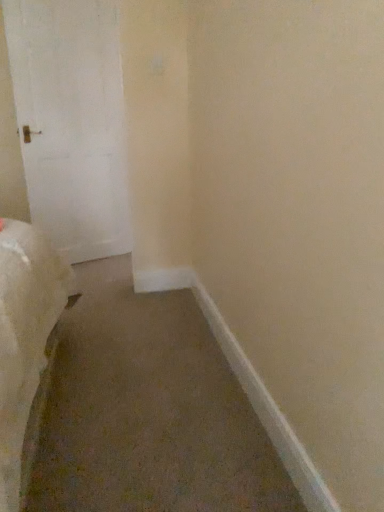
Question: Is white matte door at left completely or partially outside of white smooth baseboard at lower right?

Choices:
 (A) no
 (B) yes

Answer: (B)

Question: Is there a large distance between white matte door at left and white smooth baseboard at lower right?

Choices:
 (A) yes
 (B) no

Answer: (A)

Question: Can you confirm if white matte door at left is taller than white smooth baseboard at lower right?

Choices:
 (A) no
 (B) yes

Answer: (B)

Question: Considering the relative sizes of white matte door at left and white smooth baseboard at lower right in the image provided, is white matte door at left thinner than white smooth baseboard at lower right?

Choices:
 (A) yes
 (B) no

Answer: (B)

Question: Considering the relative positions of white matte door at left and white smooth baseboard at lower right in the image provided, is white matte door at left to the left of white smooth baseboard at lower right from the viewer's perspective?

Choices:
 (A) no
 (B) yes

Answer: (B)

Question: Can you confirm if white matte door at left is positioned to the right of white smooth baseboard at lower right?

Choices:
 (A) yes
 (B) no

Answer: (B)

Question: From the image's perspective, is white smooth baseboard at lower right on top of white matte door at left?

Choices:
 (A) no
 (B) yes

Answer: (A)

Question: Is white smooth baseboard at lower right smaller than white matte door at left?

Choices:
 (A) no
 (B) yes

Answer: (B)

Question: Can we say white smooth baseboard at lower right lies outside white matte door at left?

Choices:
 (A) yes
 (B) no

Answer: (A)

Question: Considering the relative sizes of white smooth baseboard at lower right and white matte door at left in the image provided, is white smooth baseboard at lower right taller than white matte door at left?

Choices:
 (A) yes
 (B) no

Answer: (B)

Question: Is white smooth baseboard at lower right wider than white matte door at left?

Choices:
 (A) no
 (B) yes

Answer: (A)

Question: From the image's perspective, does white smooth baseboard at lower right appear lower than white matte door at left?

Choices:
 (A) yes
 (B) no

Answer: (A)

Question: Would you say white matte door at left is inside or outside white smooth baseboard at lower right?

Choices:
 (A) outside
 (B) inside

Answer: (A)